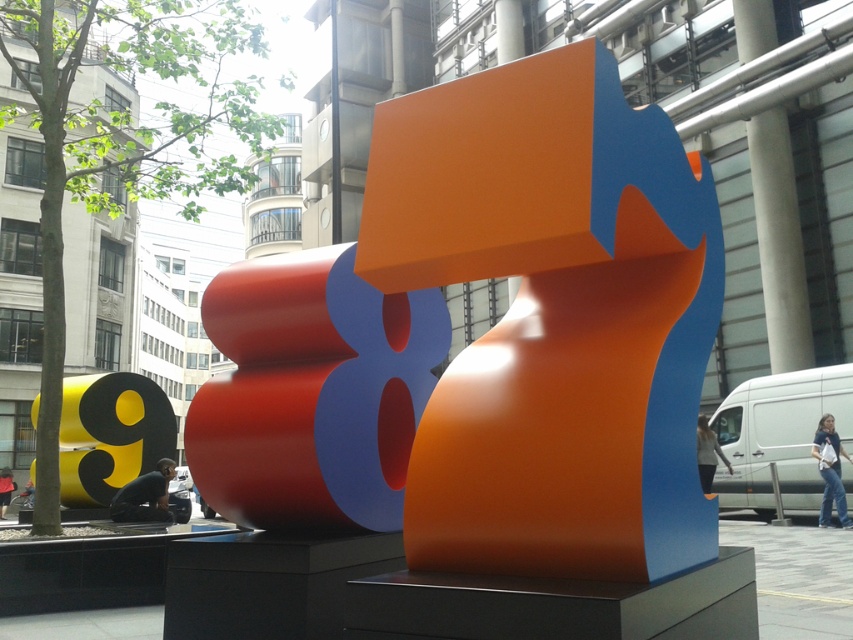
Question: Can you confirm if smooth concrete pillar at upper center is bigger than dark blue jeans at lower center?

Choices:
 (A) yes
 (B) no

Answer: (B)

Question: Does yellow glossy number at center have a larger size compared to skinny jeans at center?

Choices:
 (A) no
 (B) yes

Answer: (B)

Question: Estimate the real-world distances between objects in this image. Which object is closer to the matte black person at lower left?

Choices:
 (A) skinny jeans at center
 (B) matte orange number at center
 (C) smooth concrete pillar at upper center

Answer: (B)

Question: Is orange glossy sculpture at center thinner than smooth concrete pillar at upper center?

Choices:
 (A) no
 (B) yes

Answer: (A)

Question: Estimate the real-world distances between objects in this image. Which object is closer to the skinny jeans at center?

Choices:
 (A) matte black person at lower left
 (B) orange glossy sculpture at center

Answer: (A)

Question: Which point is closer to the camera?

Choices:
 (A) (430, 364)
 (B) (839, 467)
 (C) (125, 513)
 (D) (490, 444)

Answer: (D)